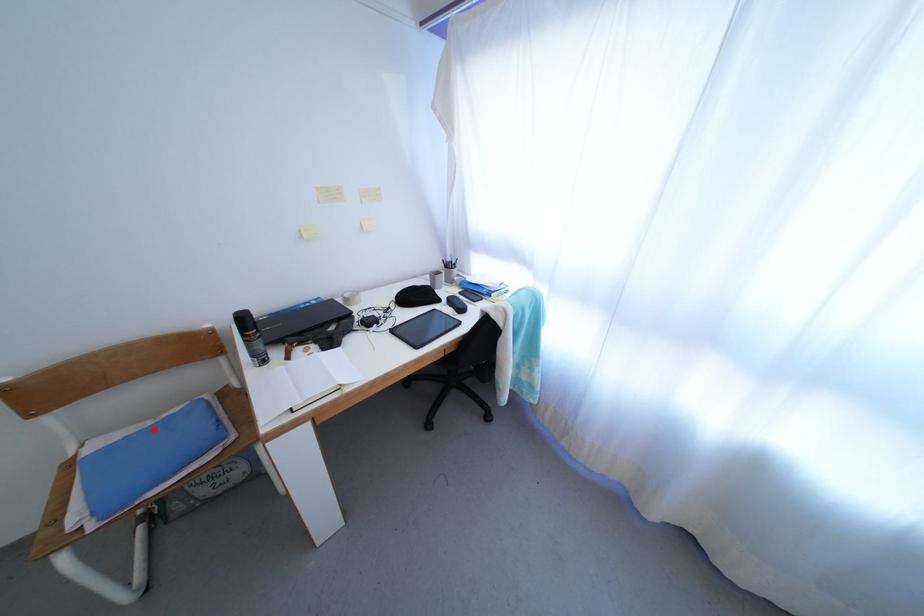
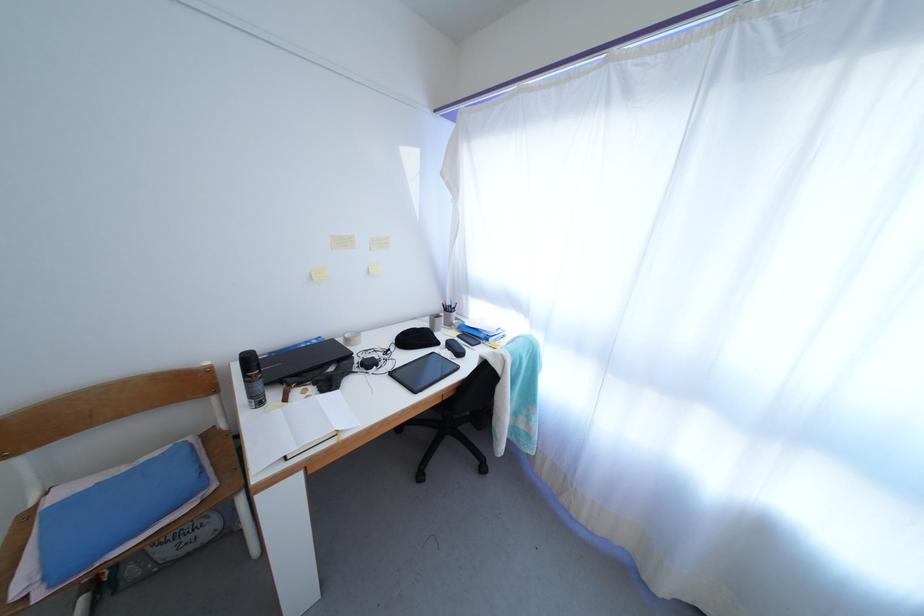
The point at the highlighted location is marked in the first image. Where is the corresponding point in the second image?

(129, 475)